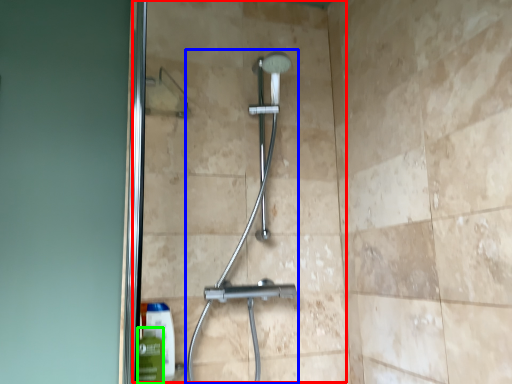
Question: Estimate the real-world distances between objects in this image. Which object is closer to glass door (highlighted by a red box), shower (highlighted by a blue box) or mouthwash (highlighted by a green box)?

Choices:
 (A) shower
 (B) mouthwash

Answer: (A)